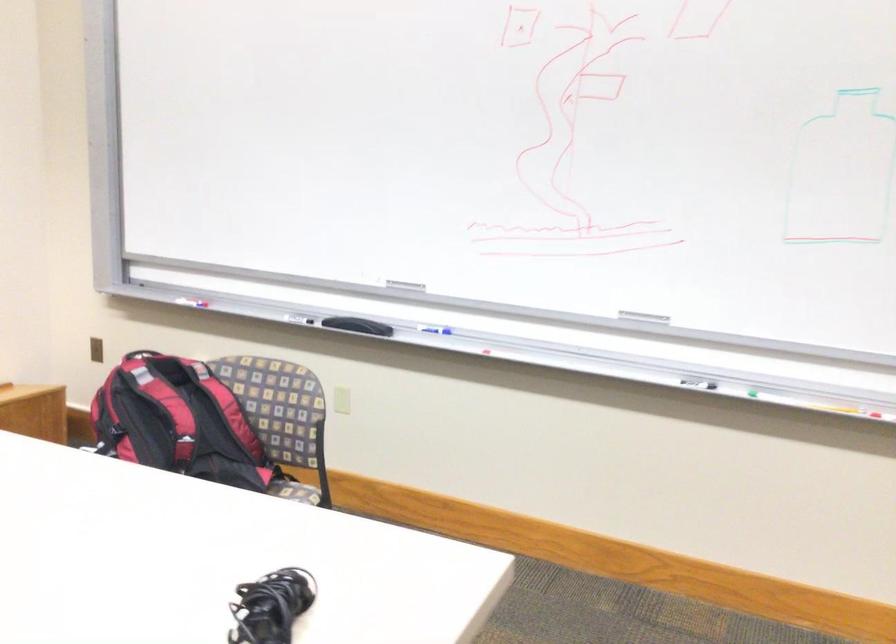
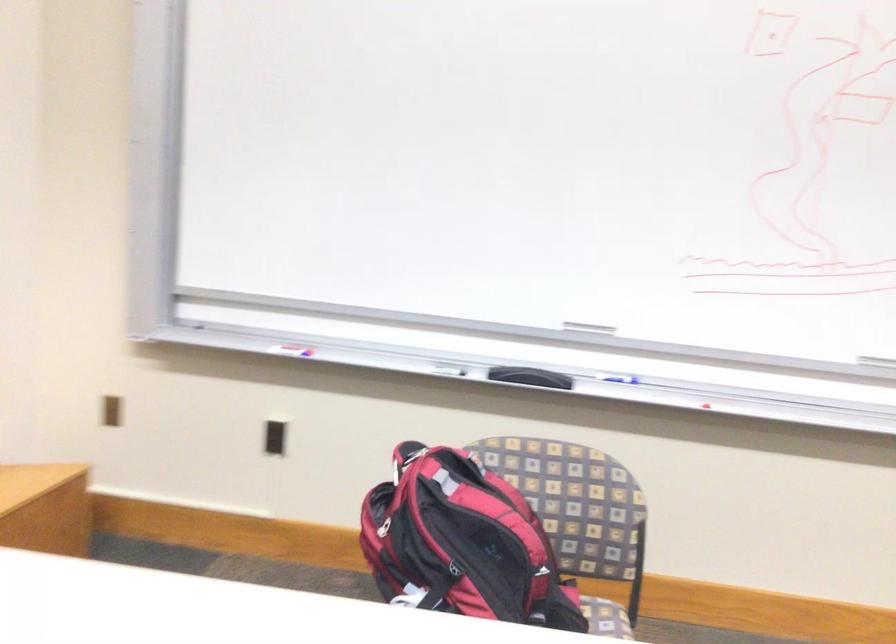
The point at (186, 292) is marked in the first image. Where is the corresponding point in the second image?

(288, 345)